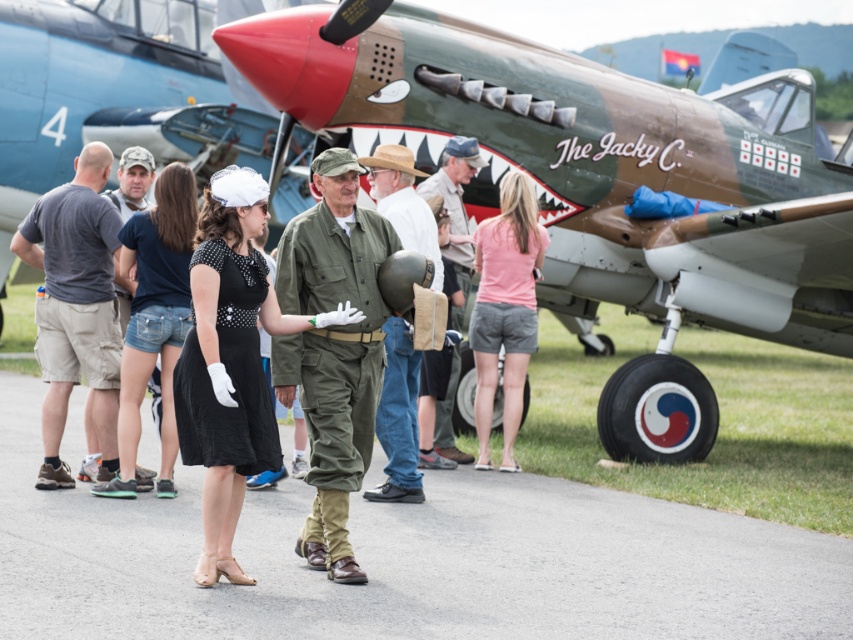
Question: Can you confirm if black satin dress at center is positioned below khaki fabric hat at center?

Choices:
 (A) no
 (B) yes

Answer: (B)

Question: Which point is farther from the camera taking this photo?

Choices:
 (A) 824,564
 (B) 171,374
 (C) 405,480

Answer: (C)

Question: Can you confirm if khaki cargo shorts at left is positioned below green fabric jacket at center?

Choices:
 (A) no
 (B) yes

Answer: (A)

Question: Can you confirm if camouflage paint airplane at center is bigger than denim shorts at center?

Choices:
 (A) no
 (B) yes

Answer: (A)

Question: Which point is farther to the camera?

Choices:
 (A) smooth asphalt at center
 (B) green camouflage airplane at upper right
 (C) green fabric uniform at center

Answer: (B)

Question: Which point is farther to the camera?

Choices:
 (A) camouflage paint airplane at center
 (B) pink fabric shorts at center
 (C) green fabric jacket at center

Answer: (A)